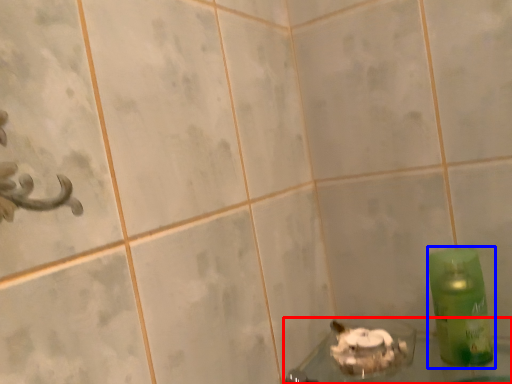
Question: Which object appears closest to the camera in this image, bath (highlighted by a red box) or bottle (highlighted by a blue box)?

Choices:
 (A) bath
 (B) bottle

Answer: (A)